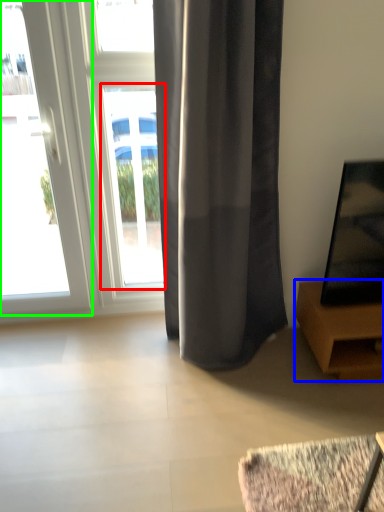
Question: Which object is the farthest from window (highlighted by a red box)? Choose among these: furniture (highlighted by a blue box) or door (highlighted by a green box).

Choices:
 (A) furniture
 (B) door

Answer: (A)